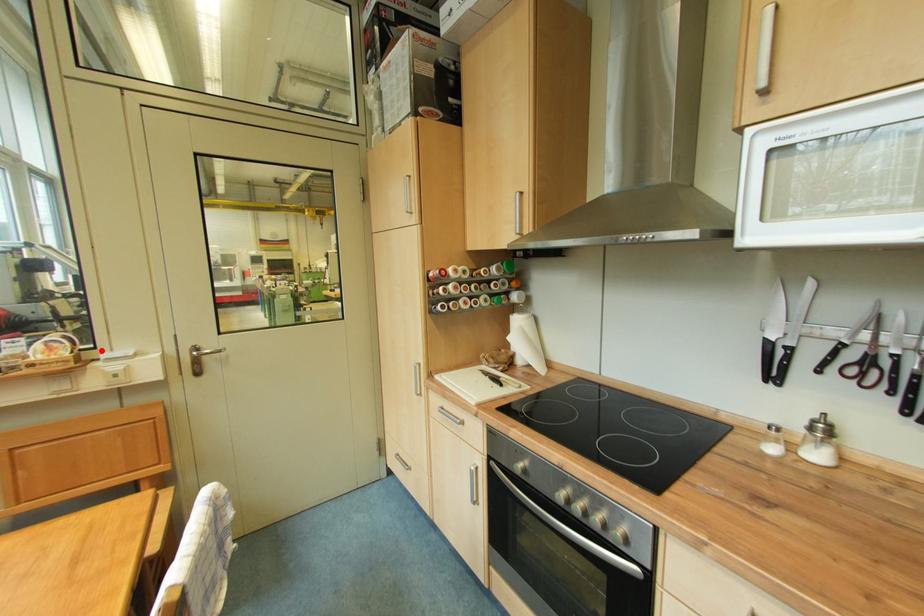
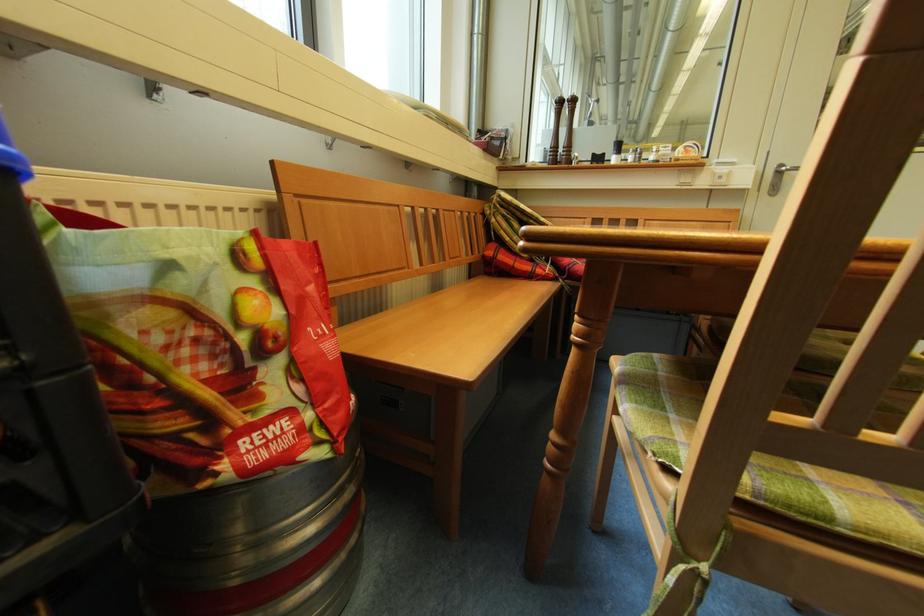
In the second image, find the point that corresponds to the highlighted location in the first image.

(714, 160)